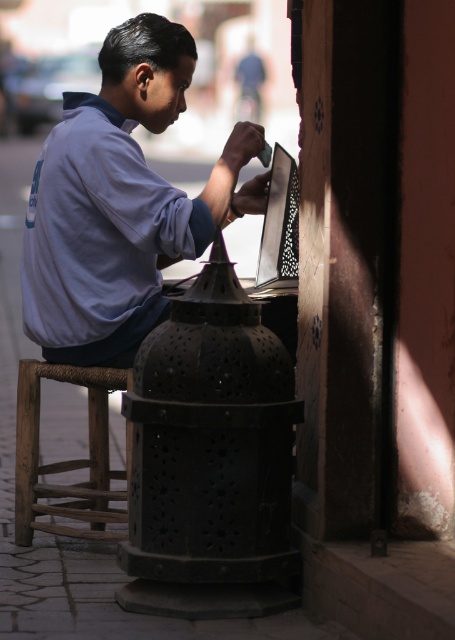
You are a photographer trying to capture a shot of the black metal lantern at center and the matte black laptop at center. Since both are at the center, how can you position yourself to ensure both are clearly visible in your frame?

Position yourself to the left of the matte black laptop at center so that the black metal lantern at center, which is to the right of the laptop, will be visible in the frame along with the laptop.